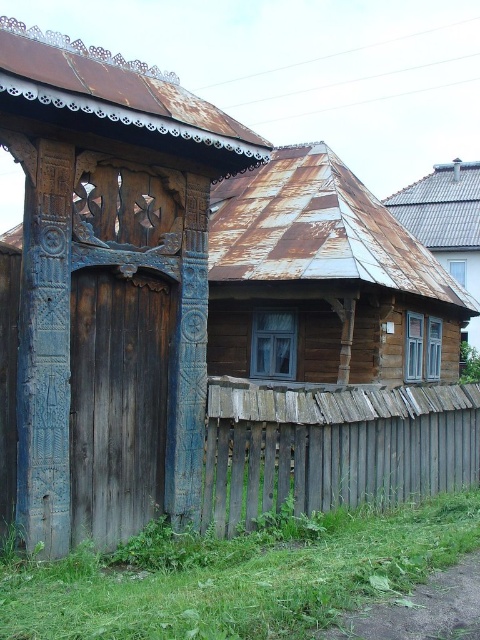
Measure the distance between weathered wood fence at center and rusty metal roof at upper right.

The distance of weathered wood fence at center from rusty metal roof at upper right is 12.02 meters.

Can you confirm if weathered wood fence at center is positioned to the left of rusty metal roof at upper right?

Indeed, weathered wood fence at center is positioned on the left side of rusty metal roof at upper right.

Where is `weathered wood fence at center`? The height and width of the screenshot is (640, 480). weathered wood fence at center is located at coordinates (333, 448).

Find the location of a particular element. Image resolution: width=480 pixels, height=640 pixels. weathered wood fence at center is located at coordinates (333, 448).

Can you confirm if blue wood log cabin at left is smaller than rusty metal roof at upper right?

Yes.

Between blue wood log cabin at left and rusty metal roof at upper right, which one has less height?

blue wood log cabin at left is shorter.

Who is more forward, (47, 323) or (424, 188)?

Positioned in front is point (47, 323).

Where is `blue wood log cabin at left`? The image size is (480, 640). blue wood log cabin at left is located at coordinates (109, 282).

Is point (113, 356) positioned before point (406, 452)?

Yes, point (113, 356) is in front of point (406, 452).

Is blue wood log cabin at left bigger than weathered wood fence at center?

Incorrect, blue wood log cabin at left is not larger than weathered wood fence at center.

I want to click on blue wood log cabin at left, so click(x=109, y=282).